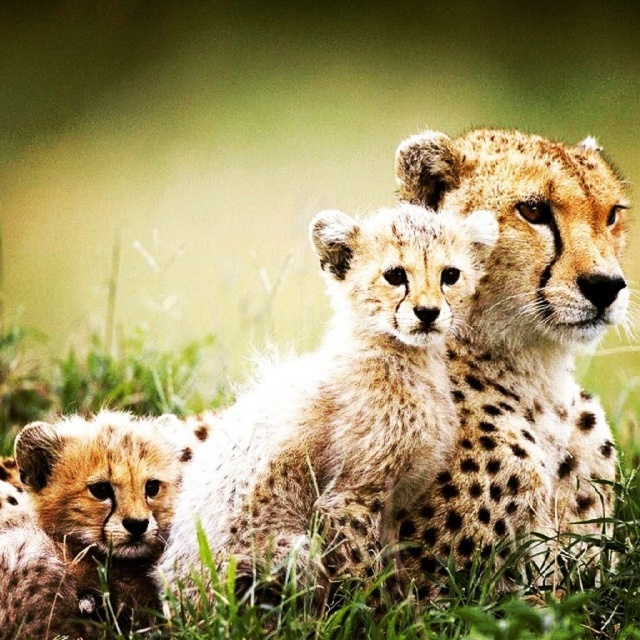
You are a wildlife photographer aiming to capture a closeup of the spotted fur cub at center and the spotted fur cheetah at upper center. Given that your camera can only focus on one subject at a time, which cheetah should you focus on first if you want to ensure the closest subject is in focus?

The spotted fur cub at center is shorter than the spotted fur cheetah at upper center, so the photographer should focus on the spotted fur cheetah at upper center first since it is closer to the camera.

In the image of three cheetahs in a savanna setting, there is a point marked at coordinates (340, 404). Which cheetah does this point lie on?

The point marked at coordinates (340, 404) lies on the spotted fur cub at center.